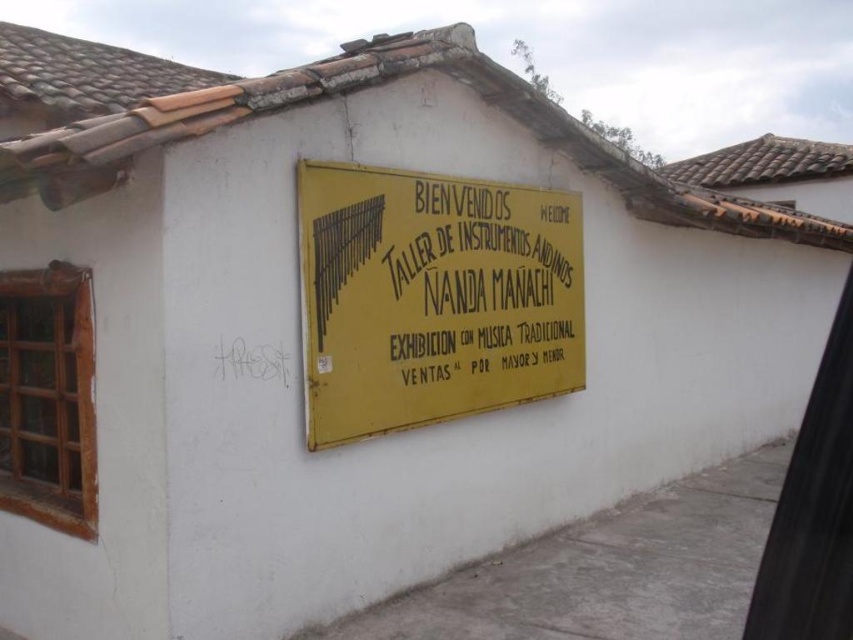
You are a visitor approaching the building and see both the yellow matte sign at center and the yellow paper sign at center. Which sign is positioned lower on the wall?

The yellow matte sign at center is located below the yellow paper sign at center, so it is positioned lower on the wall.

You are a tourist who wants to read the text on both the yellow matte sign at center and the yellow paper sign at center. Which one can you read more clearly from a distance?

The yellow matte sign at center has a larger size compared to yellow paper sign at center, so it can be read more clearly from a distance.

You are a visitor approaching the building and see both the yellow matte sign at center and the yellow paper sign at center. Which sign is positioned to the left when viewed from your perspective?

The yellow matte sign at center is to the left of the yellow paper sign at center, so the yellow matte sign at center is positioned to the left when viewed from your perspective.